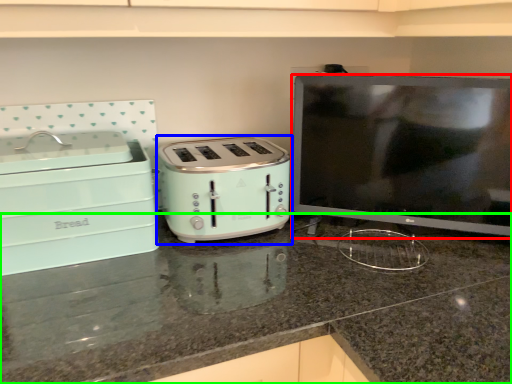
Question: Which object is positioned farthest from appliance (highlighted by a red box)? Select from toaster (highlighted by a blue box) and countertop (highlighted by a green box).

Choices:
 (A) toaster
 (B) countertop

Answer: (B)